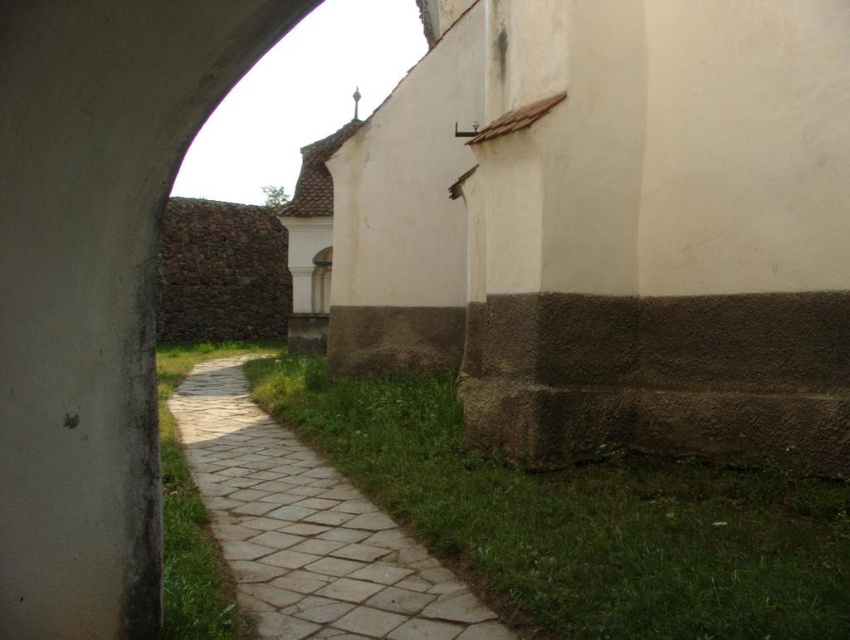
Does green grass at lower right have a lesser width compared to natural stone path at center?

No, green grass at lower right is not thinner than natural stone path at center.

Can you confirm if green grass at lower right is smaller than natural stone path at center?

No.

Who is more forward, (477, 540) or (218, 396)?

Point (477, 540) is in front.

The width and height of the screenshot is (850, 640). I want to click on green grass at lower right, so click(581, 518).